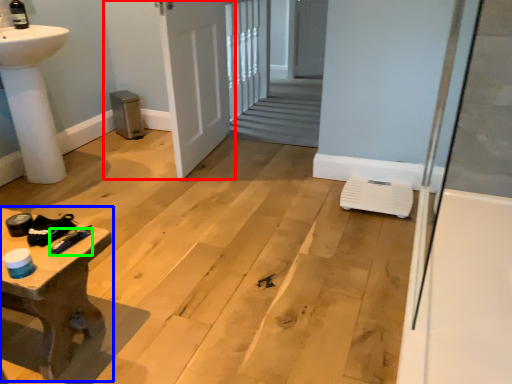
Question: Which object is positioned farthest from door (highlighted by a red box)? Select from table (highlighted by a blue box) and tool (highlighted by a green box).

Choices:
 (A) table
 (B) tool

Answer: (B)